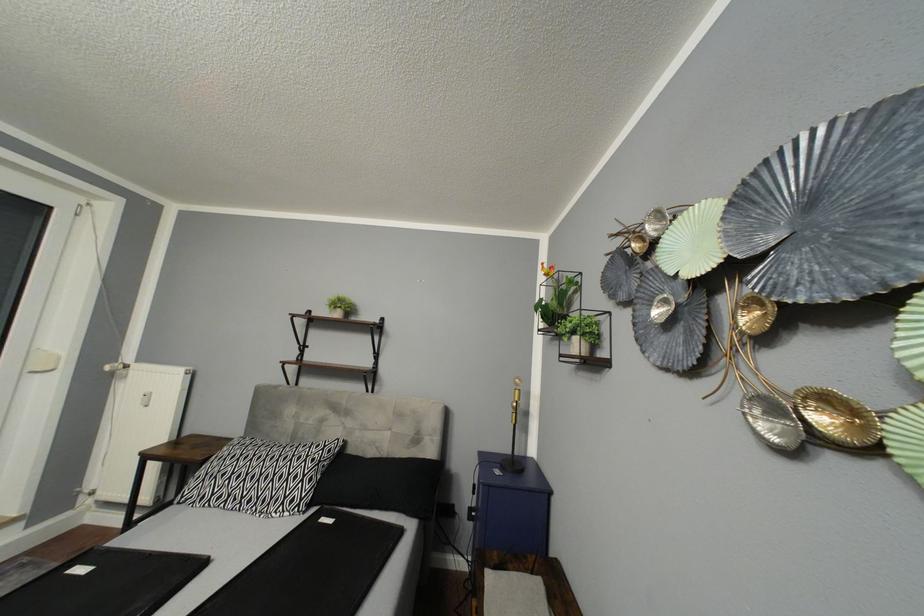
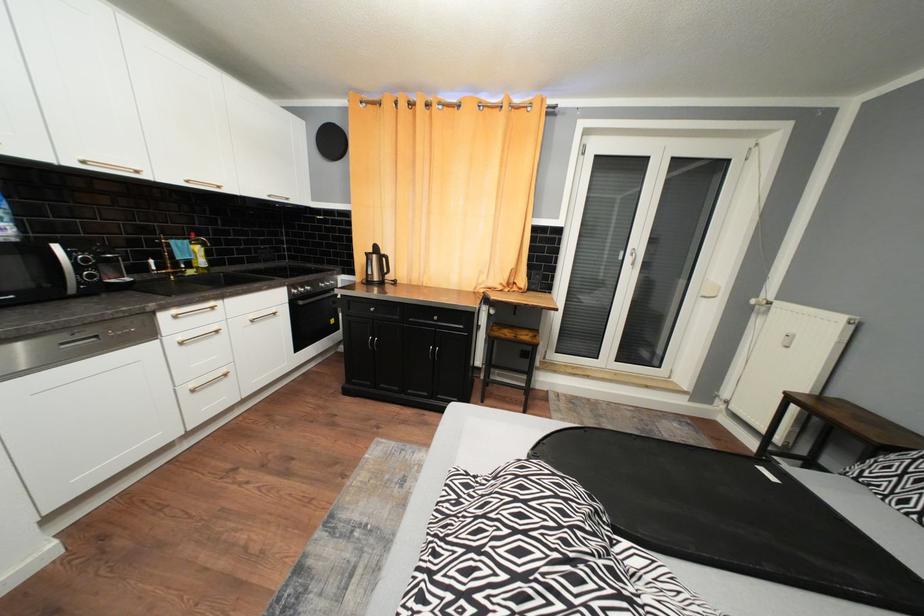
Question: The camera is either moving clockwise (left) or counter-clockwise (right) around the object. The first image is from the beginning of the video and the second image is from the end. Is the camera moving left or right when shooting the video?

Choices:
 (A) Left
 (B) Right

Answer: (B)